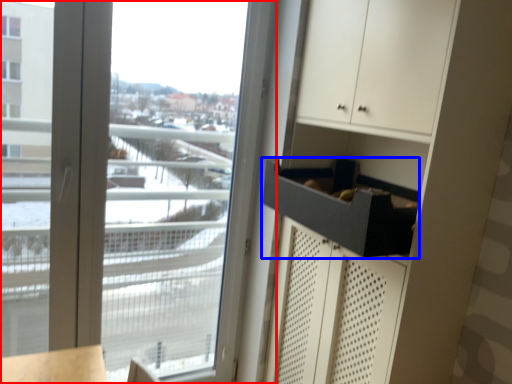
Question: Which of the following is the farthest to the observer, window (highlighted by a red box) or drawer (highlighted by a blue box)?

Choices:
 (A) window
 (B) drawer

Answer: (A)